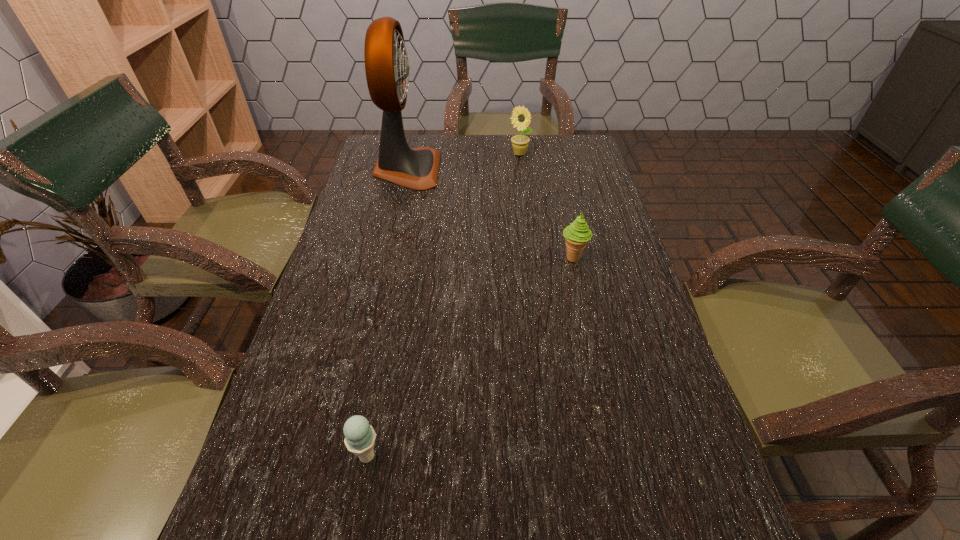
At what (x,y) coordinates should I click in order to perform the action: click on vacant area situated 0.240m on the back of the nearer ice cream. Please return your answer as a coordinate pair (x, y). This screenshot has width=960, height=540. Looking at the image, I should click on (390, 334).

The height and width of the screenshot is (540, 960). I want to click on fan that is at the far edge, so click(x=387, y=67).

This screenshot has height=540, width=960. I want to click on sunflower at the far edge, so click(x=519, y=142).

Image resolution: width=960 pixels, height=540 pixels. What are the coordinates of `object present at the left edge` in the screenshot? It's located at (387, 67).

In order to click on object that is at the right edge in this screenshot , I will do `click(577, 234)`.

At what (x,y) coordinates should I click in order to perform the action: click on object that is at the far left corner. Please return your answer as a coordinate pair (x, y). Image resolution: width=960 pixels, height=540 pixels. Looking at the image, I should click on (387, 67).

Find the location of a particular element. This screenshot has height=540, width=960. vacant area at the far edge is located at coordinates (447, 151).

Where is `free location at the left edge`? Image resolution: width=960 pixels, height=540 pixels. free location at the left edge is located at coordinates (330, 365).

Image resolution: width=960 pixels, height=540 pixels. What are the coordinates of `blank space at the right edge of the desktop` in the screenshot? It's located at (603, 244).

You are a GUI agent. You are given a task and a screenshot of the screen. Output one action in this format:
    pyautogui.click(x=<x>, y=<y>)
    Task: Click on the vacant area at the far left corner of the desktop
    
    Given the screenshot: What is the action you would take?
    pyautogui.click(x=371, y=154)